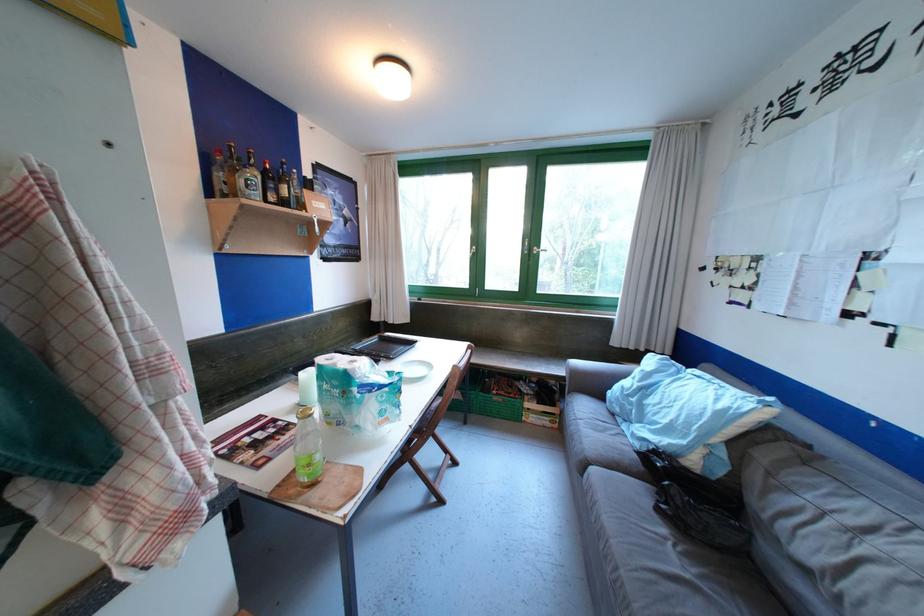
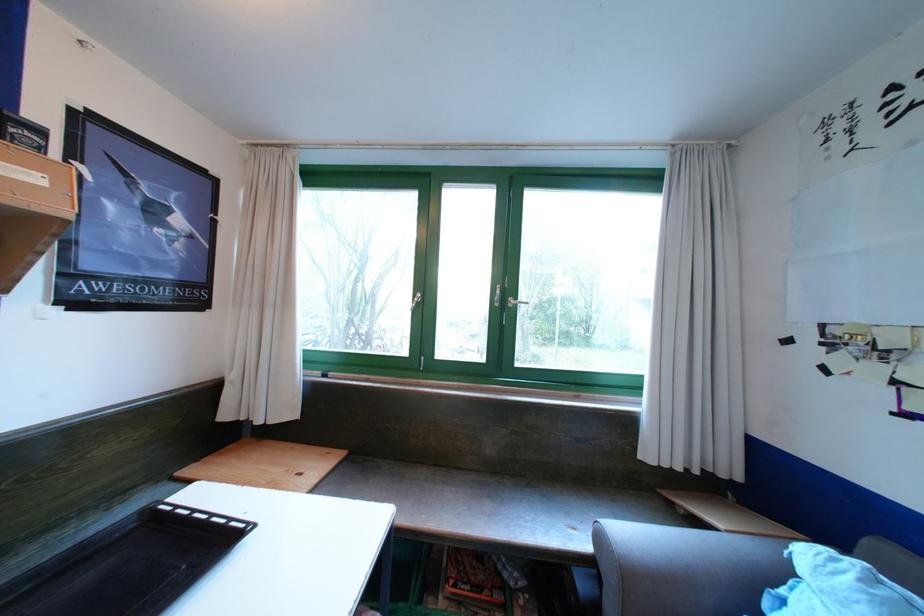
Question: The first image is from the beginning of the video and the second image is from the end. How did the camera likely rotate when shooting the video?

Choices:
 (A) Left
 (B) Right
 (C) Up
 (D) Down

Answer: (C)